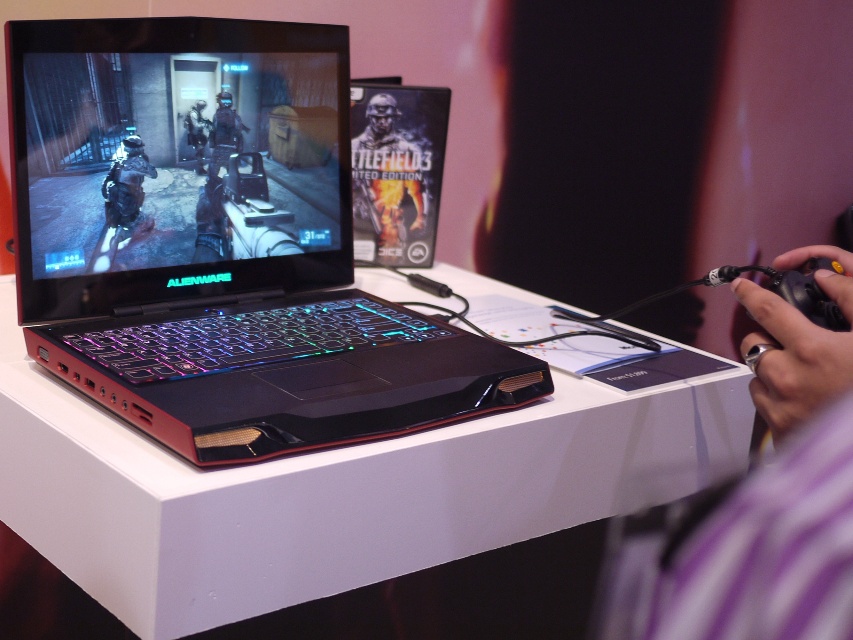
Question: Where is metallic silver controller at lower right located in relation to metallic helmet at center in the image?

Choices:
 (A) right
 (B) left

Answer: (A)

Question: Can you confirm if matte black laptop at center is positioned above metallic silver controller at lower right?

Choices:
 (A) yes
 (B) no

Answer: (A)

Question: Among these objects, which one is farthest from the camera?

Choices:
 (A) matte black laptop at center
 (B) metallic silver controller at lower right
 (C) metallic helmet at center
 (D) white glossy table at center

Answer: (C)

Question: Which point appears farthest from the camera in this image?

Choices:
 (A) (283, 268)
 (B) (310, 476)
 (C) (373, 120)
 (D) (750, 385)

Answer: (C)

Question: Which object is positioned farthest from the matte black laptop at center?

Choices:
 (A) metallic silver controller at lower right
 (B) white glossy table at center

Answer: (A)

Question: Does metallic silver controller at lower right have a larger size compared to metallic helmet at center?

Choices:
 (A) yes
 (B) no

Answer: (A)